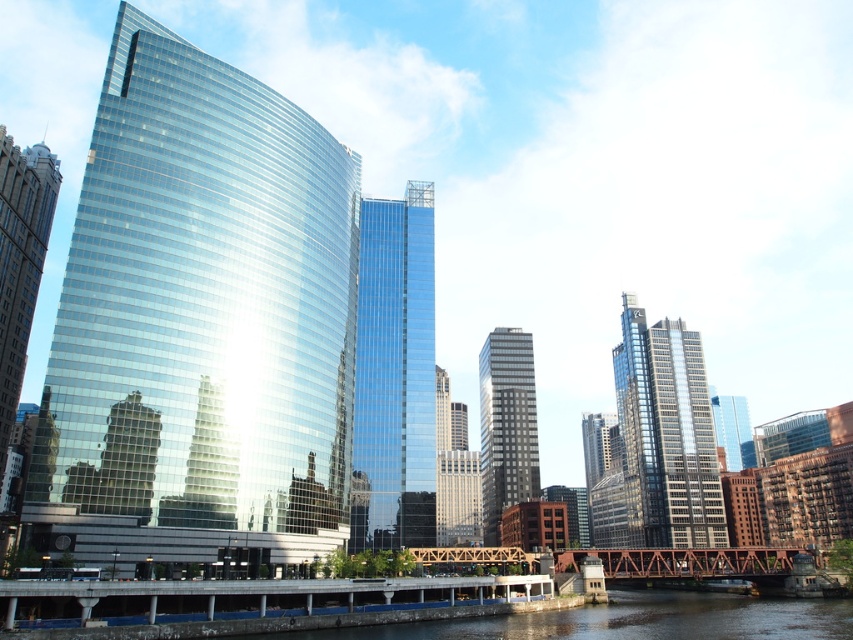
Who is lower down, glossy glass skyscraper at center or silver glass skyscraper at center?

silver glass skyscraper at center is lower down.

Is point (428, 248) behind point (479, 392)?

That is False.

Find the location of `glossy glass skyscraper at center`. glossy glass skyscraper at center is located at coordinates (393, 372).

Which is in front, point (409, 332) or point (622, 394)?

Positioned in front is point (409, 332).

Based on the photo, is glossy glass skyscraper at center positioned in front of shiny glass skyscraper at center?

Yes, glossy glass skyscraper at center is closer to the viewer.

Is point (413, 314) closer to camera compared to point (693, 440)?

Yes, point (413, 314) is closer to viewer.

Image resolution: width=853 pixels, height=640 pixels. Identify the location of glossy glass skyscraper at center. tap(393, 372).

Can you confirm if glossy glass skyscraper at center is wider than rusty steel bridge at lower center?

In fact, glossy glass skyscraper at center might be narrower than rusty steel bridge at lower center.

Based on the photo, between glossy glass skyscraper at center and rusty steel bridge at lower center, which one is positioned higher?

Positioned higher is glossy glass skyscraper at center.

Does point (387, 266) lie in front of point (699, 566)?

No, it is not.

Locate an element on the screen. Image resolution: width=853 pixels, height=640 pixels. glossy glass skyscraper at center is located at coordinates (393, 372).